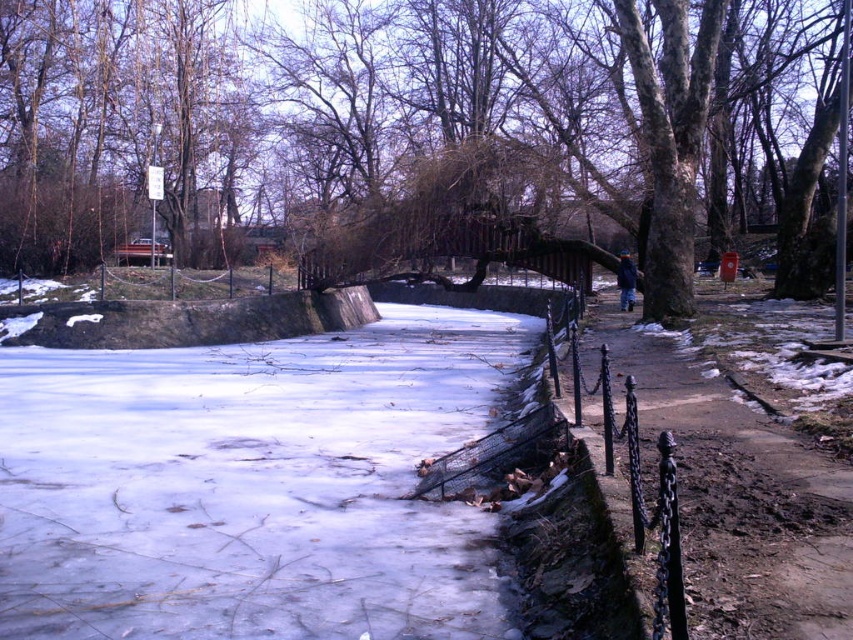
You are walking along the pathway in the winter scene and notice two black wrought iron fences. Which fence, the black wrought iron fence at right or the black wrought iron fence at lower right, is positioned further to the right from your perspective?

The black wrought iron fence at right is positioned further to the right compared to the black wrought iron fence at lower right, as stated in the description that the black wrought iron fence at right is to the right of the black wrought iron fence at lower right.

You are a photographer standing on the pathway and want to take a photo of the brown textured tree at center and the black wrought iron fence at lower right. Which object will appear larger in the photo?

The brown textured tree at center will appear larger in the photo because it is closer to the photographer than the black wrought iron fence at lower right.